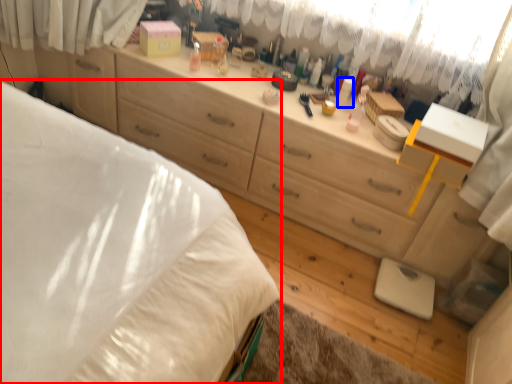
Question: Which object is further to the camera taking this photo, bed (highlighted by a red box) or toiletry (highlighted by a blue box)?

Choices:
 (A) bed
 (B) toiletry

Answer: (B)